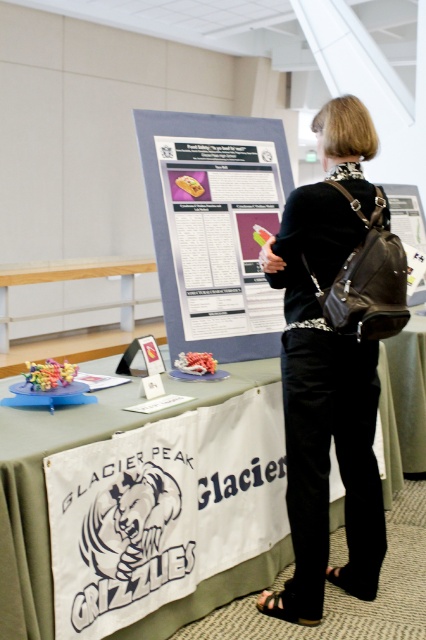
Question: Which object is the closest to the black leather backpack at center?

Choices:
 (A) matte gray poster at center
 (B) white fabric banner at lower center

Answer: (A)

Question: Considering the relative positions of black leather backpack at center and white fabric banner at lower center in the image provided, where is black leather backpack at center located with respect to white fabric banner at lower center?

Choices:
 (A) right
 (B) left

Answer: (A)

Question: Can you confirm if matte gray poster at center is positioned above white fabric banner at lower center?

Choices:
 (A) yes
 (B) no

Answer: (A)

Question: Which object is closer to the camera taking this photo?

Choices:
 (A) black leather backpack at center
 (B) matte gray poster at center

Answer: (A)

Question: Can you confirm if matte gray poster at center is bigger than white fabric banner at lower center?

Choices:
 (A) no
 (B) yes

Answer: (A)

Question: Which object appears farthest from the camera in this image?

Choices:
 (A) matte gray poster at center
 (B) white fabric banner at lower center
 (C) black leather backpack at center

Answer: (A)